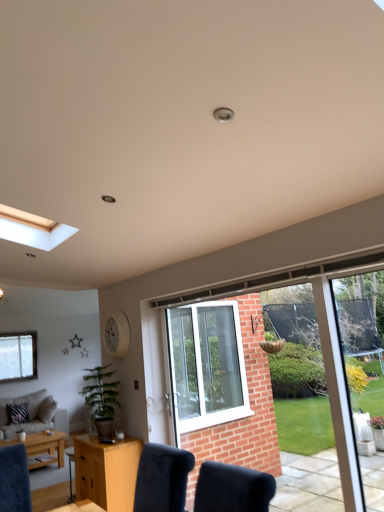
Question: Is light brown wooden coffee table at lower left positioned beyond the bounds of clear glass window at lower left, acting as the 2th window starting from the right?

Choices:
 (A) yes
 (B) no

Answer: (A)

Question: From a real-world perspective, is light brown wooden coffee table at lower left beneath clear glass window at lower left, acting as the 2th window starting from the right?

Choices:
 (A) no
 (B) yes

Answer: (B)

Question: Is light brown wooden coffee table at lower left beside clear glass window at lower left, the first window positioned from the left?

Choices:
 (A) no
 (B) yes

Answer: (A)

Question: Is light brown wooden coffee table at lower left facing towards clear glass window at lower left, acting as the 2th window starting from the right?

Choices:
 (A) no
 (B) yes

Answer: (A)

Question: From the image's perspective, would you say light brown wooden coffee table at lower left is positioned over clear glass window at lower left, the 2th window from the front?

Choices:
 (A) yes
 (B) no

Answer: (B)

Question: From their relative heights in the image, would you say clear glass window at lower left, the 2th window from the front, is taller or shorter than beige fabric couch at lower left?

Choices:
 (A) short
 (B) tall

Answer: (A)

Question: From the image's perspective, is clear glass window at lower left, the first window positioned from the left, positioned above or below beige fabric couch at lower left?

Choices:
 (A) below
 (B) above

Answer: (B)

Question: Choose the correct answer: Is clear glass window at lower left, arranged as the first window when viewed from the back, inside beige fabric couch at lower left or outside it?

Choices:
 (A) inside
 (B) outside

Answer: (B)

Question: Based on their sizes in the image, would you say clear glass window at lower left, the 2th window from the front, is bigger or smaller than beige fabric couch at lower left?

Choices:
 (A) small
 (B) big

Answer: (A)

Question: Is light brown wood desk at lower center situated inside light brown wooden coffee table at lower left or outside?

Choices:
 (A) outside
 (B) inside

Answer: (A)

Question: In the image, is light brown wood desk at lower center positioned in front of or behind light brown wooden coffee table at lower left?

Choices:
 (A) behind
 (B) front

Answer: (B)

Question: Looking at the image, does light brown wood desk at lower center seem bigger or smaller compared to light brown wooden coffee table at lower left?

Choices:
 (A) small
 (B) big

Answer: (A)

Question: From the image's perspective, is light brown wood desk at lower center located above or below light brown wooden coffee table at lower left?

Choices:
 (A) below
 (B) above

Answer: (B)

Question: In the image, is beige fabric couch at lower left positioned in front of or behind light brown wooden coffee table at lower left?

Choices:
 (A) behind
 (B) front

Answer: (A)

Question: In terms of height, does beige fabric couch at lower left look taller or shorter compared to light brown wooden coffee table at lower left?

Choices:
 (A) short
 (B) tall

Answer: (B)